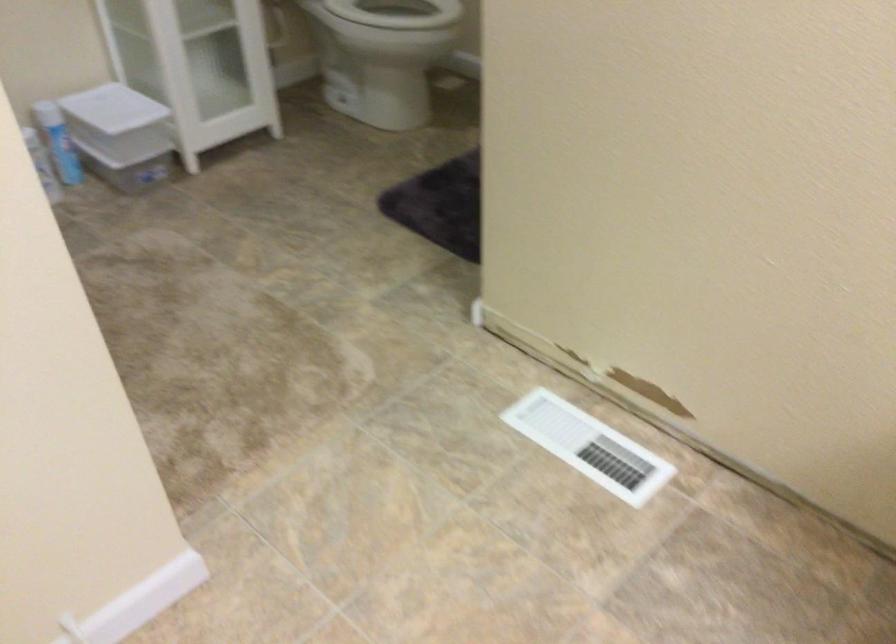
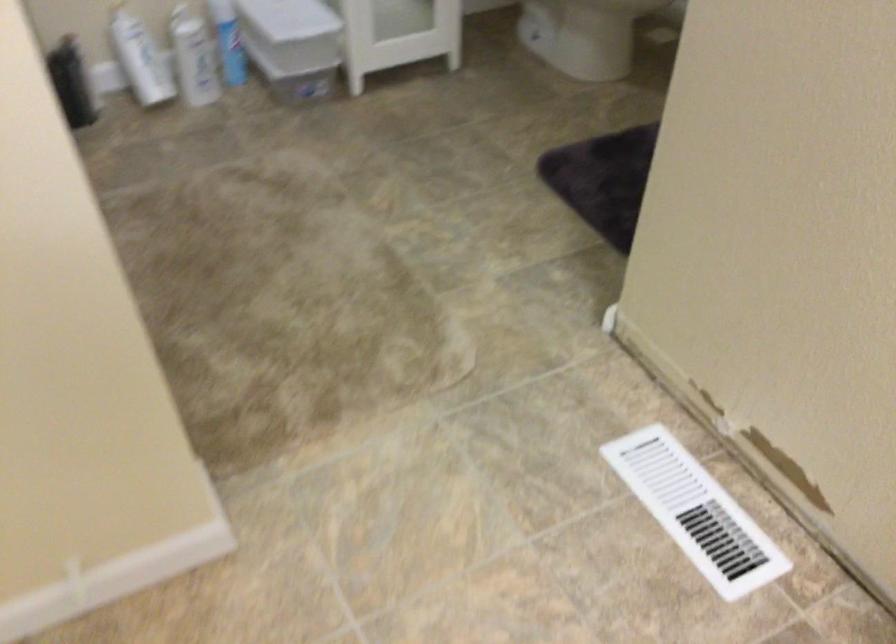
Find the pixel in the second image that matches (x=590, y=448) in the first image.

(695, 512)